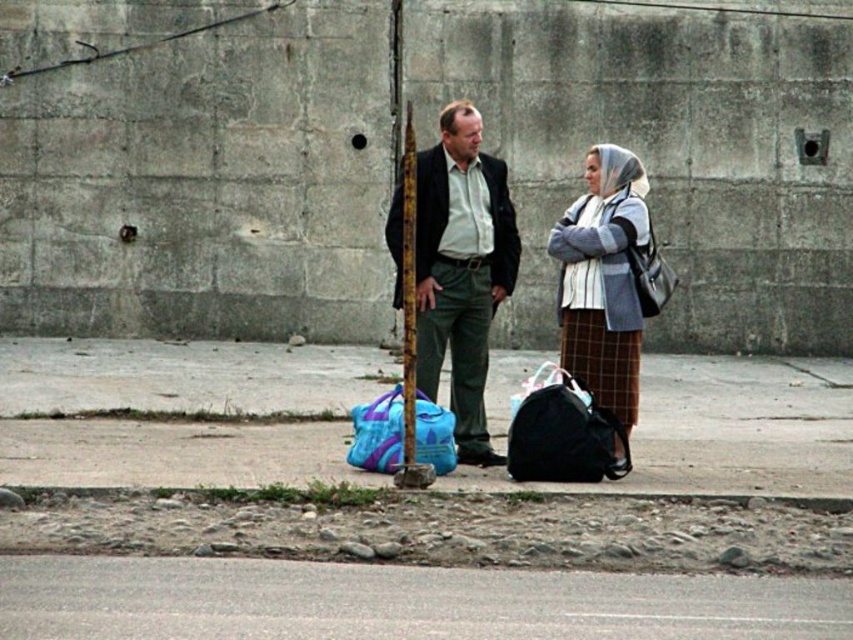
Question: Which point is closer to the camera?

Choices:
 (A) matte black bag at right
 (B) smooth concrete curb at lower center
 (C) dark green fabric jacket at center

Answer: (B)

Question: Among these points, which one is farthest from the camera?

Choices:
 (A) (534, 410)
 (B) (390, 241)

Answer: (B)

Question: Which object appears closest to the camera in this image?

Choices:
 (A) brushed metal pole at center
 (B) matte black bag at right
 (C) matte blue duffel bag at center

Answer: (A)

Question: Is plaid skirt at center to the right of brushed metal pole at center from the viewer's perspective?

Choices:
 (A) yes
 (B) no

Answer: (A)

Question: Is the position of plaid skirt at center less distant than that of smooth concrete curb at lower center?

Choices:
 (A) no
 (B) yes

Answer: (A)

Question: Does asphalt at lower center come behind brushed metal pole at center?

Choices:
 (A) yes
 (B) no

Answer: (B)